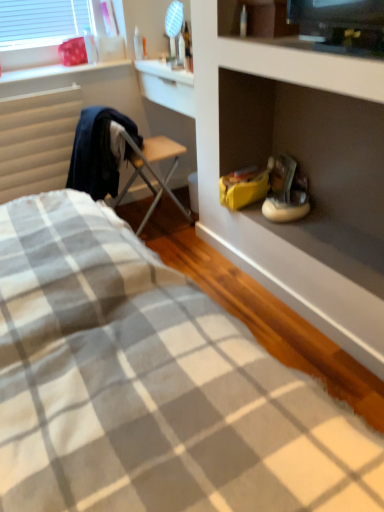
Identify the location of empty space that is ontop of white painted wood at upper left (from a real-world perspective). (66, 66).